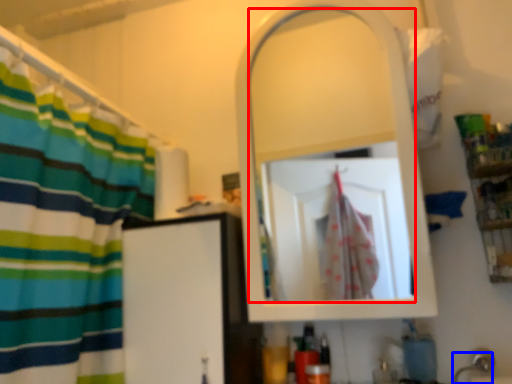
Question: Which of the following is the closest to the observer, mirror (highlighted by a red box) or faucet (highlighted by a blue box)?

Choices:
 (A) mirror
 (B) faucet

Answer: (B)